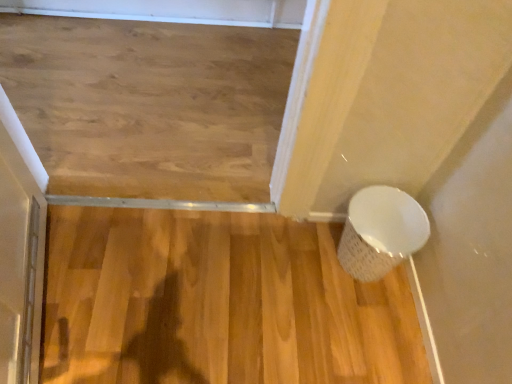
Question: Considering the positions of point (393, 223) and point (47, 347), is point (393, 223) closer or farther from the camera than point (47, 347)?

Choices:
 (A) closer
 (B) farther

Answer: (B)

Question: Based on their positions, is white textured basket at lower right located to the left or right of natural wood floor at center?

Choices:
 (A) left
 (B) right

Answer: (B)

Question: Considering the positions of white textured basket at lower right and natural wood floor at center in the image, is white textured basket at lower right wider or thinner than natural wood floor at center?

Choices:
 (A) wide
 (B) thin

Answer: (B)

Question: From a real-world perspective, is natural wood floor at center above or below white textured basket at lower right?

Choices:
 (A) below
 (B) above

Answer: (A)

Question: In terms of size, does natural wood floor at center appear bigger or smaller than white textured basket at lower right?

Choices:
 (A) big
 (B) small

Answer: (A)

Question: In the image, is natural wood floor at center positioned in front of or behind white textured basket at lower right?

Choices:
 (A) behind
 (B) front

Answer: (B)

Question: In terms of height, does natural wood floor at center look taller or shorter compared to white textured basket at lower right?

Choices:
 (A) tall
 (B) short

Answer: (B)